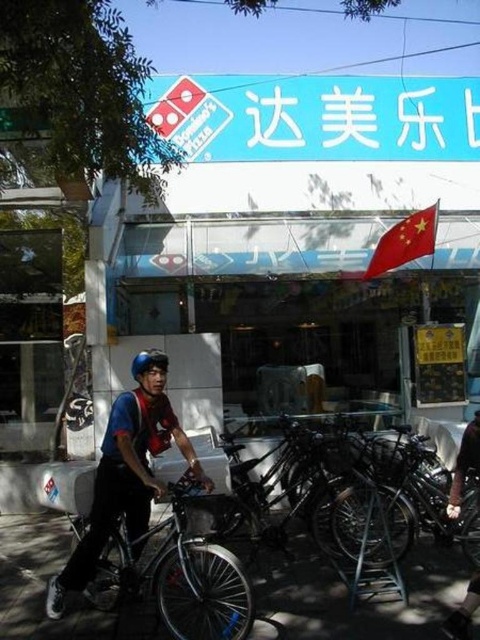
Which is more to the left, shiny metallic bicycle at center or red helmet at center?

Positioned to the left is red helmet at center.

Can you confirm if shiny metallic bicycle at center is shorter than red helmet at center?

Indeed, shiny metallic bicycle at center has a lesser height compared to red helmet at center.

Who is more distant from viewer, [280,451] or [107,531]?

Point [280,451]

I want to click on shiny metallic bicycle at center, so click(319, 493).

How much distance is there between shiny metallic bicycle at center and matte blue helmet at center?

shiny metallic bicycle at center and matte blue helmet at center are 6.34 feet apart.

Where is `shiny metallic bicycle at center`? shiny metallic bicycle at center is located at coordinates (319, 493).

You are a GUI agent. You are given a task and a screenshot of the screen. Output one action in this format:
    pyautogui.click(x=<x>, y=<y>)
    Task: Click on the shiny metallic bicycle at center
    
    Given the screenshot: What is the action you would take?
    pyautogui.click(x=319, y=493)

Is silver metallic bicycle at center taller than matte blue helmet at center?

Indeed, silver metallic bicycle at center has a greater height compared to matte blue helmet at center.

Is silver metallic bicycle at center below matte blue helmet at center?

Indeed, silver metallic bicycle at center is positioned under matte blue helmet at center.

Measure the distance between point (247, 614) and camera.

Point (247, 614) is 3.66 meters from camera.

Image resolution: width=480 pixels, height=640 pixels. What are the coordinates of `silver metallic bicycle at center` in the screenshot? It's located at (182, 576).